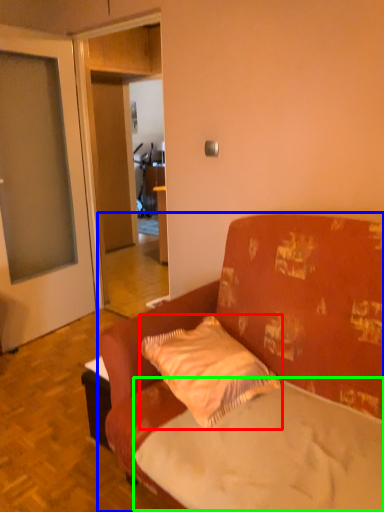
Question: Which object is positioned farthest from pillow (highlighted by a red box)? Select from studio couch (highlighted by a blue box) and mattress (highlighted by a green box).

Choices:
 (A) studio couch
 (B) mattress

Answer: (B)